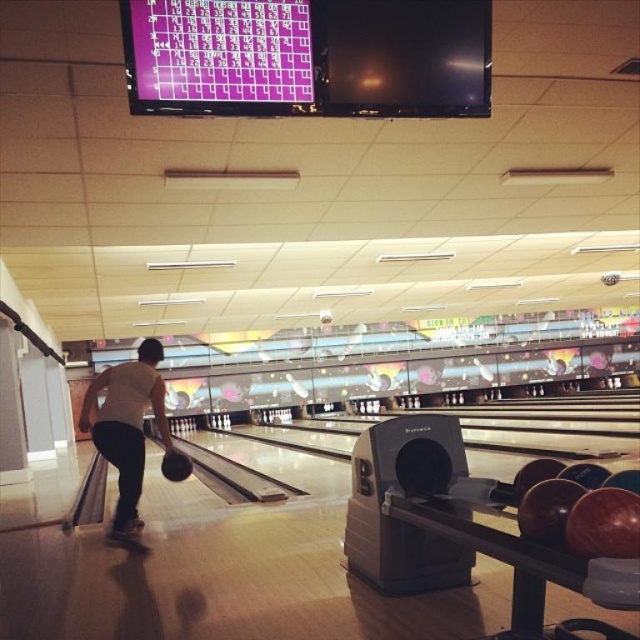
Is purple glossy scoreboard at upper center thinner than white matte bowling ball at center?

No.

Which is more to the left, purple glossy scoreboard at upper center or white matte bowling ball at center?

From the viewer's perspective, white matte bowling ball at center appears more on the left side.

Identify the location of purple glossy scoreboard at upper center. (307, 58).

At what (x,y) coordinates should I click in order to perform the action: click on purple glossy scoreboard at upper center. Please return your answer as a coordinate pair (x, y). Looking at the image, I should click on [x=307, y=58].